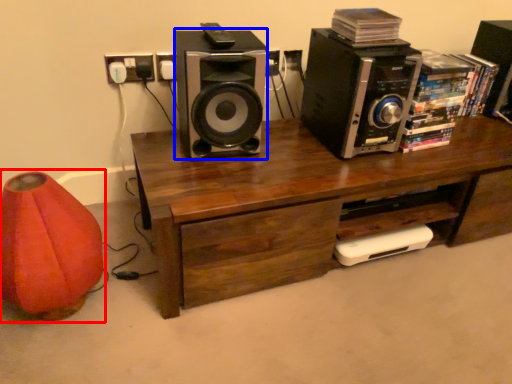
Question: Which point is further to the camera, bean bag chair (highlighted by a red box) or speaker (highlighted by a blue box)?

Choices:
 (A) bean bag chair
 (B) speaker

Answer: (B)